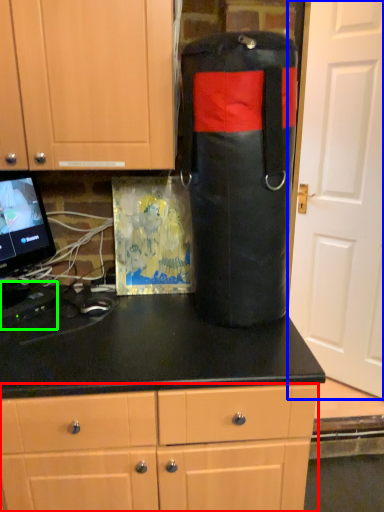
Question: Which object is positioned farthest from cabinetry (highlighted by a red box)? Select from door (highlighted by a blue box) and appliance (highlighted by a green box).

Choices:
 (A) door
 (B) appliance

Answer: (A)